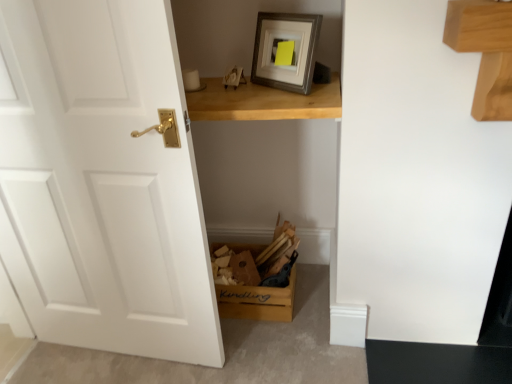
Where is `free space above light brown wooden table at upper center (from a real-world perspective)`? The image size is (512, 384). free space above light brown wooden table at upper center (from a real-world perspective) is located at coordinates (240, 89).